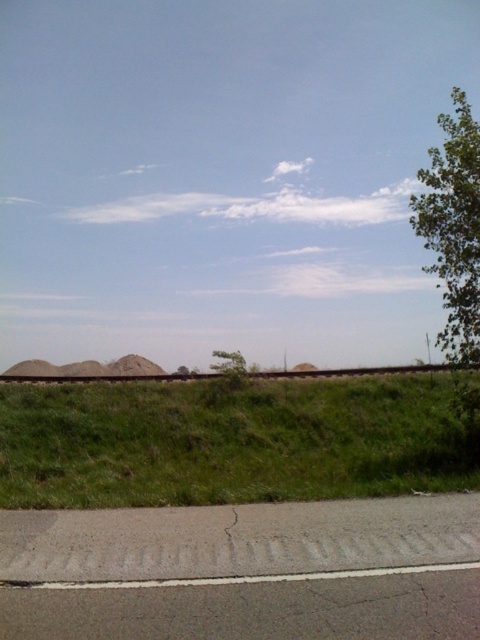
Is green grassy hill at center bigger than green leafy tree at upper right?

Actually, green grassy hill at center might be smaller than green leafy tree at upper right.

Is point (266, 428) positioned after point (433, 186)?

Yes.

Where is `green grassy hill at center`? green grassy hill at center is located at coordinates (233, 440).